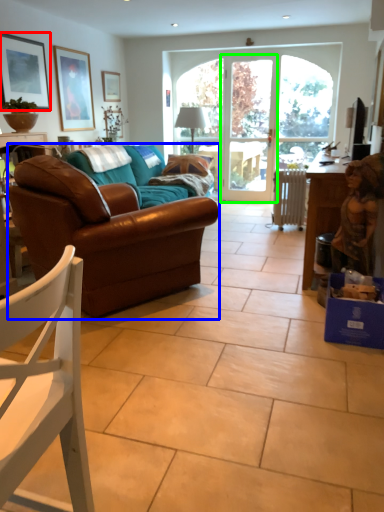
Question: Which object is the farthest from picture frame (highlighted by a red box)? Choose among these: studio couch (highlighted by a blue box) or screen door (highlighted by a green box).

Choices:
 (A) studio couch
 (B) screen door

Answer: (B)